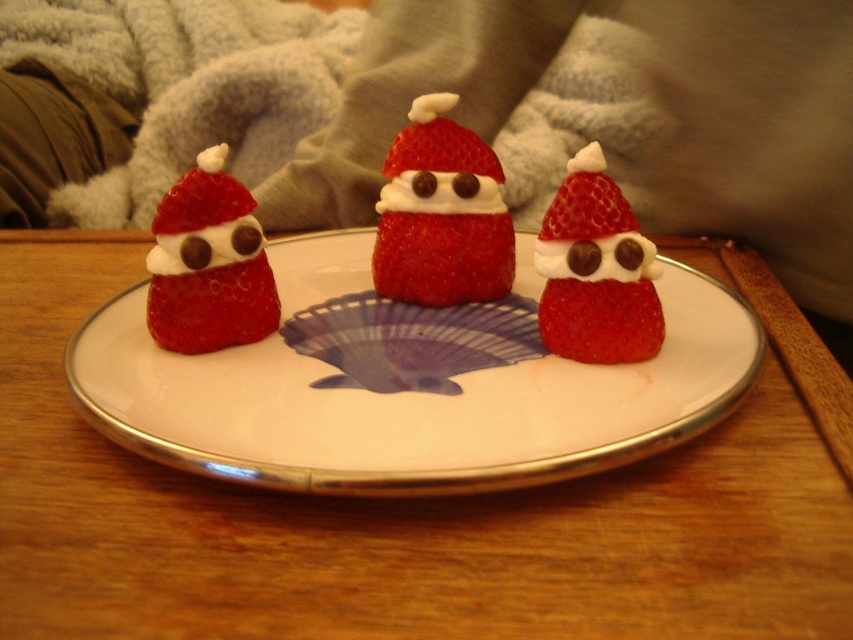
From the picture: You are a guest at a holiday party and see the fuzzy gray blanket at upper center and the matte chocolate strawberry at left on the table. Which item would you need to move first to make space for a small gift box you want to place near the center of the table?

The fuzzy gray blanket at upper center is larger in size than the matte chocolate strawberry at left, so you should move the fuzzy gray blanket at upper center first to create enough space for the gift box.

In the scene shown: You are planning to place a small decorative snow globe that is 10 cm wide on the plate. Considering the space occupied by the fuzzy gray blanket at upper center and the matte chocolate strawberry at left, will there be enough room for the snow globe?

The fuzzy gray blanket at upper center is wider than the matte chocolate strawberry at left. However, since the snow globe is 10 cm wide and the plate has a decorative blue fish design in the center, there might be sufficient space depending on the arrangement of the strawberries. But based on the given information about the blanket and strawberry sizes, the blanket being wider suggests the plate might be large enough to accommodate the snow globe without overlapping the existing items.